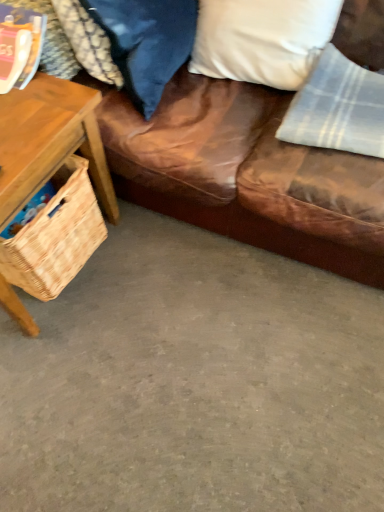
The width and height of the screenshot is (384, 512). Find the location of `free location in front of woven straw picnic basket at left`. free location in front of woven straw picnic basket at left is located at coordinates (71, 341).